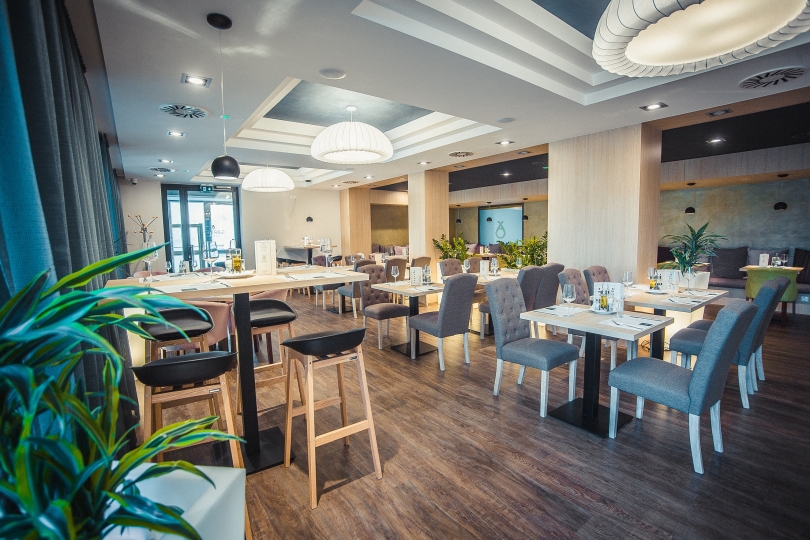
Identify the location of bar stool. The image size is (810, 540). (190, 370), (177, 319), (258, 317), (312, 342).